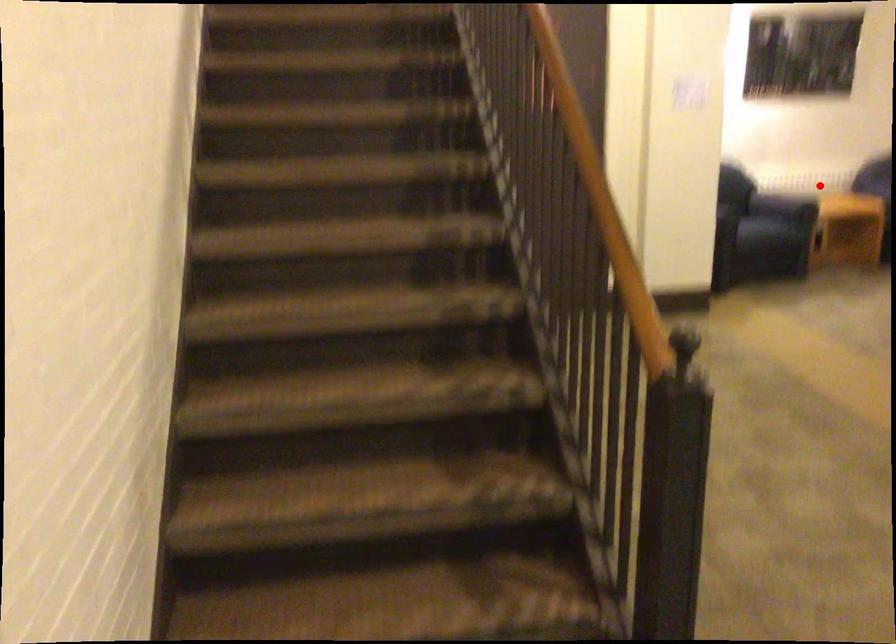
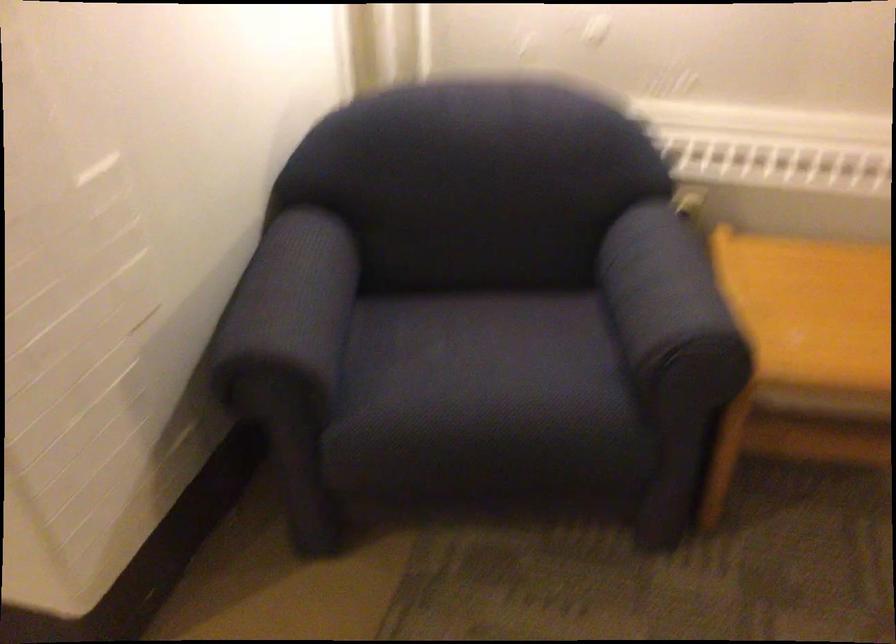
In the second image, find the point that corresponds to the highlighted location in the first image.

(670, 307)